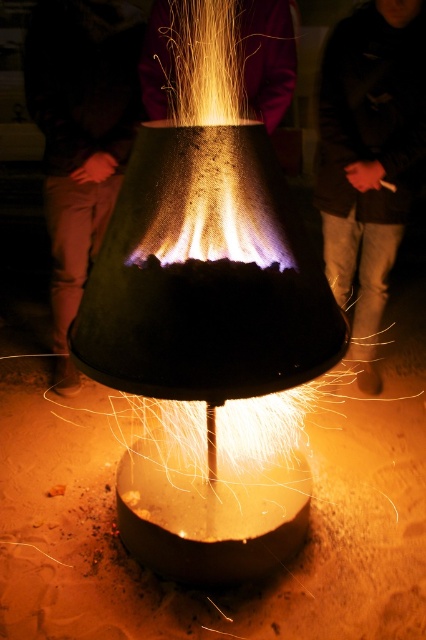
This screenshot has height=640, width=426. Describe the element at coordinates (221, 589) in the screenshot. I see `sandy brown sand at bottom center` at that location.

Who is shorter, sandy brown sand at bottom center or dark brown leather jacket at center?

Standing shorter between the two is sandy brown sand at bottom center.

Identify the location of sandy brown sand at bottom center. The image size is (426, 640). (221, 589).

This screenshot has width=426, height=640. What are the coordinates of `sandy brown sand at bottom center` in the screenshot? It's located at (221, 589).